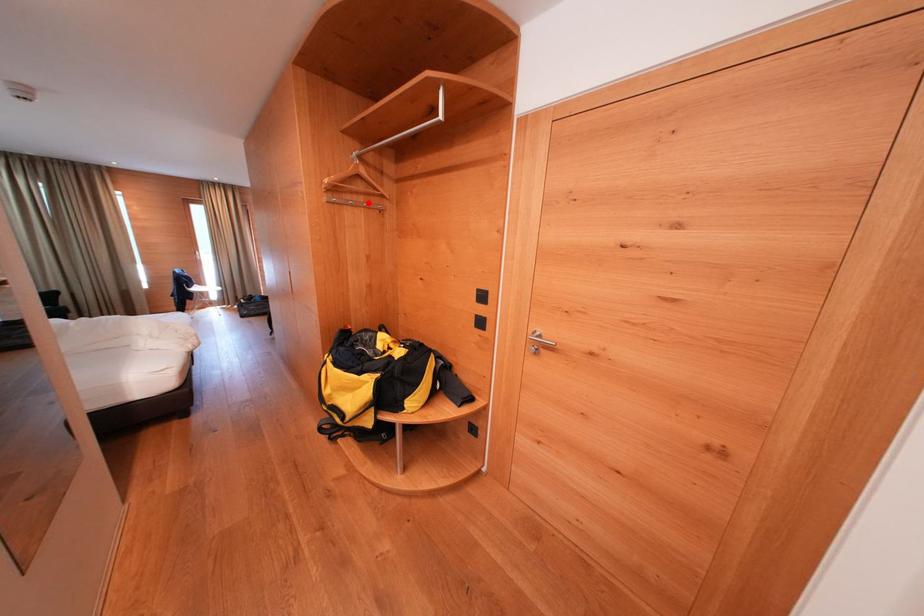
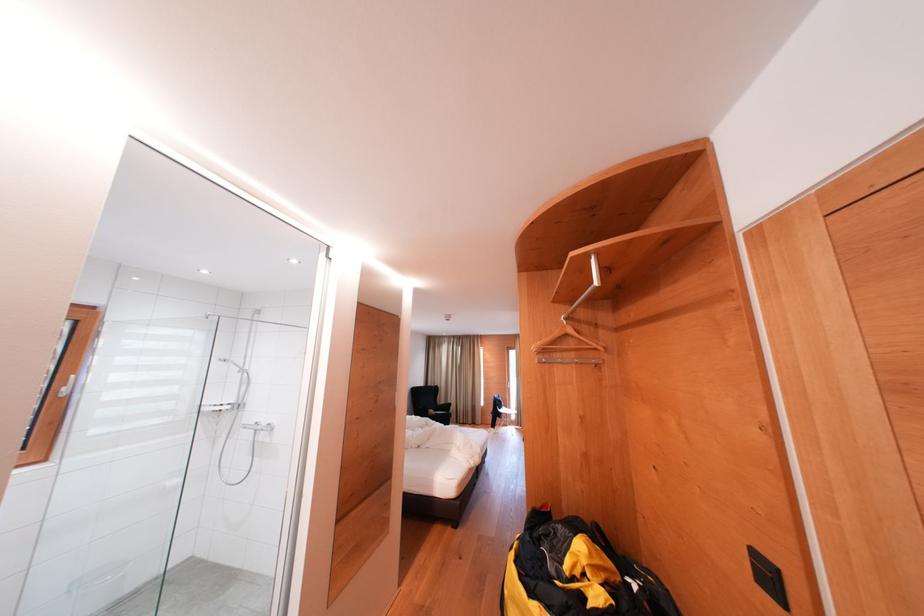
Find the pixel in the second image that matches the highlighted location in the first image.

(579, 359)